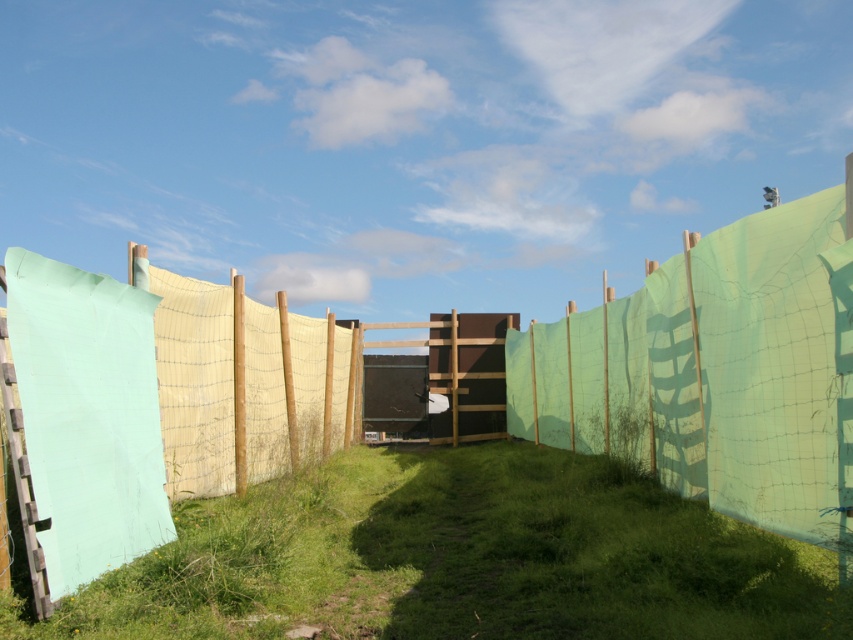
Question: Does green grassy at center have a greater width compared to green netting at center?

Choices:
 (A) yes
 (B) no

Answer: (B)

Question: Can you confirm if green grassy at center is wider than green netting at center?

Choices:
 (A) no
 (B) yes

Answer: (A)

Question: Observing the image, what is the correct spatial positioning of green grassy at center in reference to green netting at center?

Choices:
 (A) right
 (B) left

Answer: (B)